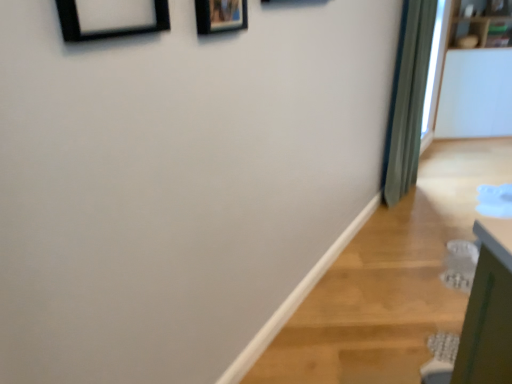
Question: From a real-world perspective, does wooden picture frame at upper center, placed as the second picture frame when sorted from front to back, sit lower than black matte picture frame at upper left, acting as the 2th picture frame starting from the right?

Choices:
 (A) yes
 (B) no

Answer: (B)

Question: Is black matte picture frame at upper left, placed as the 2th picture frame when sorted from back to front, at the back of wooden picture frame at upper center, placed as the second picture frame when sorted from front to back?

Choices:
 (A) yes
 (B) no

Answer: (B)

Question: Considering the relative sizes of wooden picture frame at upper center, which ranks as the 2th picture frame in left-to-right order, and black matte picture frame at upper left, marked as the 1th picture frame in a front-to-back arrangement, in the image provided, is wooden picture frame at upper center, which ranks as the 2th picture frame in left-to-right order, thinner than black matte picture frame at upper left, marked as the 1th picture frame in a front-to-back arrangement,?

Choices:
 (A) no
 (B) yes

Answer: (B)

Question: Is wooden picture frame at upper center, which is counted as the 1th picture frame, starting from the back, touching black matte picture frame at upper left, marked as the 1th picture frame in a front-to-back arrangement?

Choices:
 (A) yes
 (B) no

Answer: (B)

Question: From the image's perspective, would you say wooden picture frame at upper center, acting as the 1th picture frame starting from the right, is positioned over black matte picture frame at upper left, placed as the 1th picture frame when sorted from left to right?

Choices:
 (A) no
 (B) yes

Answer: (B)

Question: Considering the positions of green fabric curtain at right and wooden picture frame at upper center, placed as the second picture frame when sorted from front to back, in the image, is green fabric curtain at right taller or shorter than wooden picture frame at upper center, placed as the second picture frame when sorted from front to back,?

Choices:
 (A) short
 (B) tall

Answer: (B)

Question: In terms of size, does green fabric curtain at right appear bigger or smaller than wooden picture frame at upper center, acting as the 1th picture frame starting from the right?

Choices:
 (A) big
 (B) small

Answer: (A)

Question: From the image's perspective, is green fabric curtain at right positioned above or below wooden picture frame at upper center, acting as the 1th picture frame starting from the right?

Choices:
 (A) above
 (B) below

Answer: (A)

Question: Is point pyautogui.click(x=419, y=87) closer or farther from the camera than point pyautogui.click(x=203, y=4)?

Choices:
 (A) closer
 (B) farther

Answer: (B)

Question: In terms of height, does wooden picture frame at upper center, which ranks as the 2th picture frame in left-to-right order, look taller or shorter compared to black matte picture frame at upper left, marked as the 1th picture frame in a front-to-back arrangement?

Choices:
 (A) tall
 (B) short

Answer: (A)

Question: Considering the positions of wooden picture frame at upper center, acting as the 1th picture frame starting from the right, and black matte picture frame at upper left, placed as the 2th picture frame when sorted from back to front, in the image, is wooden picture frame at upper center, acting as the 1th picture frame starting from the right, wider or thinner than black matte picture frame at upper left, placed as the 2th picture frame when sorted from back to front,?

Choices:
 (A) wide
 (B) thin

Answer: (B)

Question: Is point (217, 0) closer or farther from the camera than point (103, 31)?

Choices:
 (A) farther
 (B) closer

Answer: (A)

Question: From a real-world perspective, relative to black matte picture frame at upper left, placed as the 2th picture frame when sorted from back to front, is wooden picture frame at upper center, which ranks as the 2th picture frame in left-to-right order, vertically above or below?

Choices:
 (A) below
 (B) above

Answer: (B)

Question: Would you say green fabric curtain at right is to the left or to the right of black matte picture frame at upper left, placed as the 2th picture frame when sorted from back to front, in the picture?

Choices:
 (A) right
 (B) left

Answer: (A)

Question: Is green fabric curtain at right inside or outside of black matte picture frame at upper left, placed as the 1th picture frame when sorted from left to right?

Choices:
 (A) outside
 (B) inside

Answer: (A)